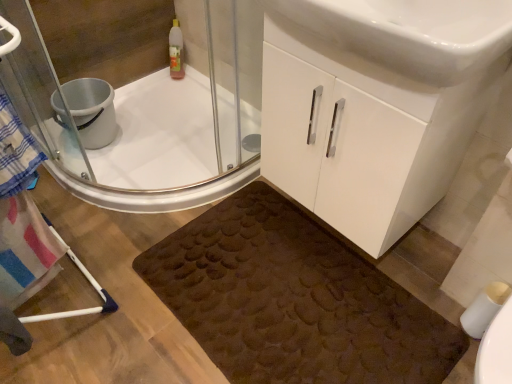
Question: Is white matte toilet paper at lower right smaller than white glossy cabinet at center?

Choices:
 (A) yes
 (B) no

Answer: (A)

Question: Does white matte toilet paper at lower right turn towards white glossy cabinet at center?

Choices:
 (A) yes
 (B) no

Answer: (B)

Question: Considering the relative sizes of white matte toilet paper at lower right and white glossy cabinet at center in the image provided, is white matte toilet paper at lower right shorter than white glossy cabinet at center?

Choices:
 (A) yes
 (B) no

Answer: (A)

Question: From the image's perspective, is white matte toilet paper at lower right above white glossy cabinet at center?

Choices:
 (A) no
 (B) yes

Answer: (A)

Question: From the image's perspective, is white matte toilet paper at lower right below white glossy cabinet at center?

Choices:
 (A) no
 (B) yes

Answer: (B)

Question: From the image's perspective, is white glossy sink at center positioned above or below clear glass shower door at upper left?

Choices:
 (A) below
 (B) above

Answer: (B)

Question: Considering the positions of white glossy sink at center and clear glass shower door at upper left in the image, is white glossy sink at center bigger or smaller than clear glass shower door at upper left?

Choices:
 (A) big
 (B) small

Answer: (A)

Question: Relative to clear glass shower door at upper left, is white glossy sink at center in front or behind?

Choices:
 (A) front
 (B) behind

Answer: (A)

Question: Is white glossy sink at center situated inside clear glass shower door at upper left or outside?

Choices:
 (A) inside
 (B) outside

Answer: (B)

Question: Considering their positions, is silver metallic bucket at upper left located in front of or behind white glossy cabinet at center?

Choices:
 (A) front
 (B) behind

Answer: (B)

Question: Is silver metallic bucket at upper left inside or outside of white glossy cabinet at center?

Choices:
 (A) outside
 (B) inside

Answer: (A)

Question: Visually, is silver metallic bucket at upper left positioned to the left or to the right of white glossy cabinet at center?

Choices:
 (A) left
 (B) right

Answer: (A)

Question: Does point (95, 92) appear closer or farther from the camera than point (306, 71)?

Choices:
 (A) farther
 (B) closer

Answer: (A)

Question: Would you say silver metallic bucket at upper left is to the left or to the right of white glossy sink at center in the picture?

Choices:
 (A) right
 (B) left

Answer: (B)

Question: From the image's perspective, is silver metallic bucket at upper left above or below white glossy sink at center?

Choices:
 (A) below
 (B) above

Answer: (A)